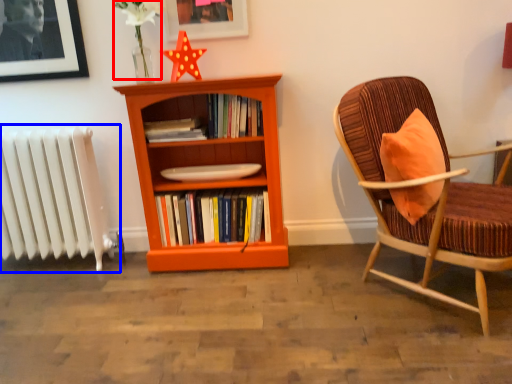
Question: Which object appears farthest to the camera in this image, flower (highlighted by a red box) or radiator (highlighted by a blue box)?

Choices:
 (A) flower
 (B) radiator

Answer: (B)